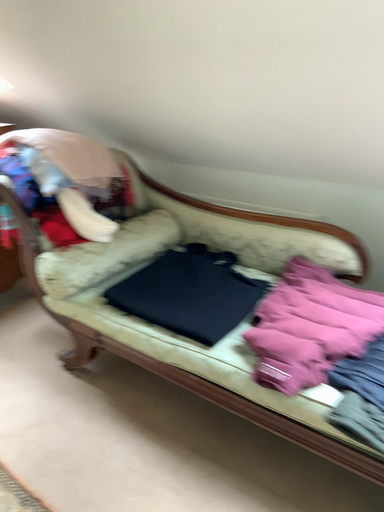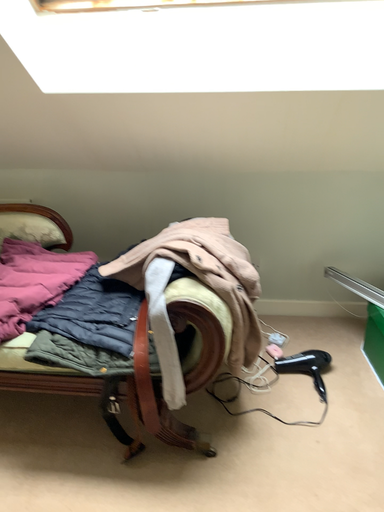
Question: Which way did the camera rotate in the video?

Choices:
 (A) rotated left
 (B) rotated right

Answer: (B)